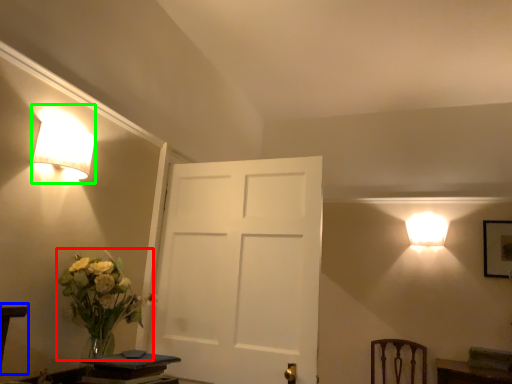
Question: Based on their relative distances, which object is nearer to floral arrangement (highlighted by a red box)? Choose from table (highlighted by a blue box) and lamp (highlighted by a green box).

Choices:
 (A) table
 (B) lamp

Answer: (A)